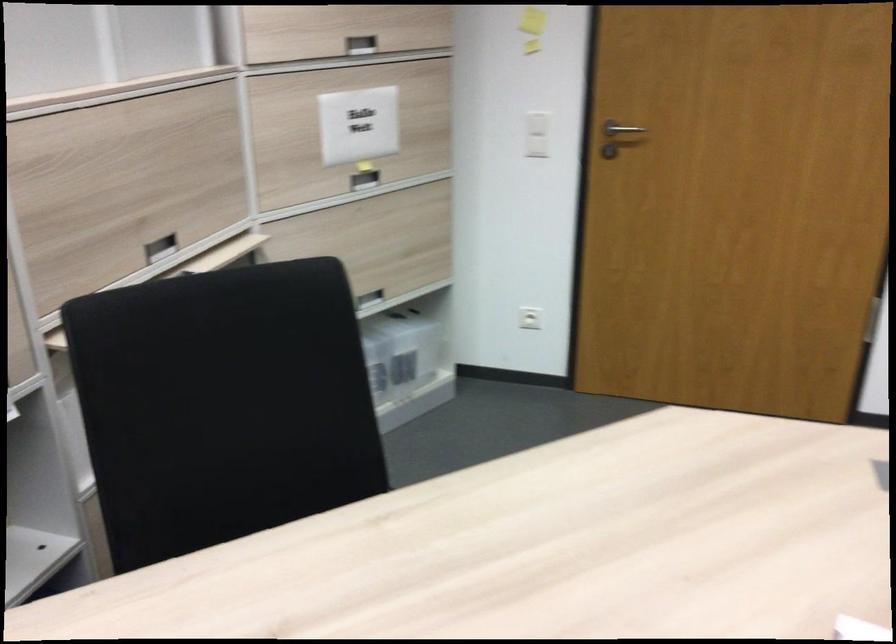
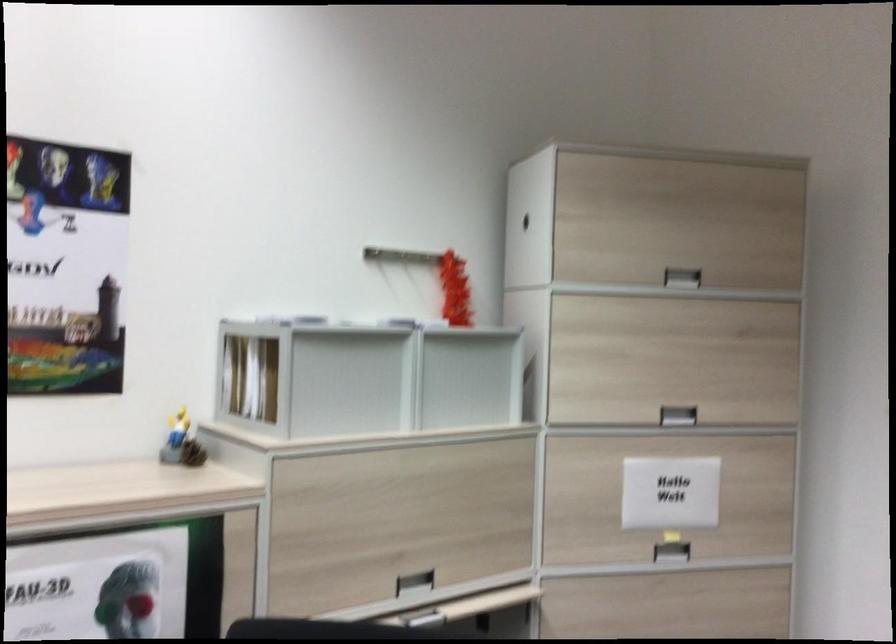
The point at (162,251) is marked in the first image. Where is the corresponding point in the second image?

(415, 583)